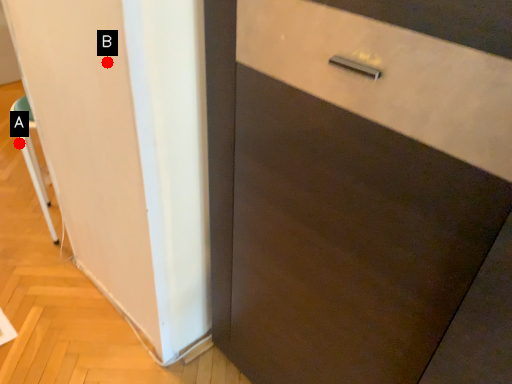
Question: Two points are circled on the image, labeled by A and B beside each circle. Which point appears farthest from the camera in this image?

Choices:
 (A) A is further
 (B) B is further

Answer: (A)